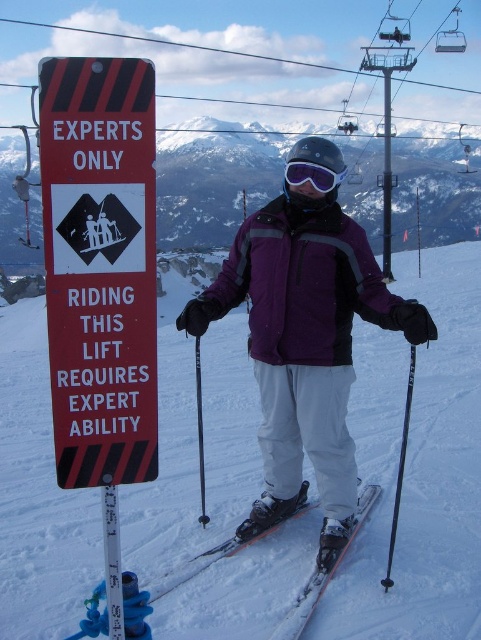
Measure the distance between purple softshell jacket at center and camera.

They are 7.27 meters apart.

From the picture: Is purple softshell jacket at center to the right of shiny metallic skis at center from the viewer's perspective?

No, purple softshell jacket at center is not to the right of shiny metallic skis at center.

Does point (285, 387) lie behind point (209, 557)?

Yes, it is.

This screenshot has width=481, height=640. I want to click on purple softshell jacket at center, so click(x=304, y=346).

Describe the element at coordinates (325, 568) in the screenshot. I see `shiny metallic skis at center` at that location.

Is point (161, 593) positioned before point (280, 628)?

No, it is not.

Where is `shiny metallic skis at center`? shiny metallic skis at center is located at coordinates (325, 568).

The height and width of the screenshot is (640, 481). Identify the location of shiny metallic skis at center. (325, 568).

Does shiny metallic ski at center have a lesser height compared to purple matte ski goggles at center?

Correct, shiny metallic ski at center is not as tall as purple matte ski goggles at center.

Is point (344, 545) closer to viewer compared to point (302, 161)?

Yes.

Who is more distant from viewer, (x=318, y=572) or (x=340, y=179)?

The point (x=340, y=179) is more distant.

At what (x,y) coordinates should I click in order to perform the action: click on shiny metallic ski at center. Please return your answer as a coordinate pair (x, y). The height and width of the screenshot is (640, 481). Looking at the image, I should click on (325, 568).